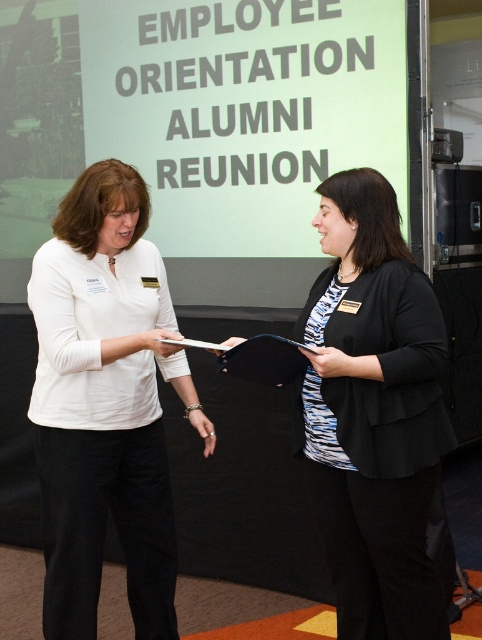
Is black matte blazer at center shorter than black matte folder at center?

Incorrect, black matte blazer at center's height does not fall short of black matte folder at center's.

How much distance is there between black matte blazer at center and black matte folder at center?

They are 10.36 inches apart.

In the scene shown: Who is more distant from viewer, [399,381] or [252,372]?

The point [252,372] is more distant.

You are a GUI agent. You are given a task and a screenshot of the screen. Output one action in this format:
    pyautogui.click(x=<x>, y=<y>)
    Task: Click on the black matte blazer at center
    The height and width of the screenshot is (640, 482).
    Given the screenshot: What is the action you would take?
    pyautogui.click(x=373, y=413)

Measure the distance between white matte shirt at center and black matte folder at center.

The distance of white matte shirt at center from black matte folder at center is 17.00 inches.

Which is more to the left, white matte shirt at center or black matte folder at center?

white matte shirt at center is more to the left.

Between point (137, 321) and point (296, 362), which one is positioned in front?

Point (296, 362) is in front.

Find the location of `white matte shirt at center`. white matte shirt at center is located at coordinates (106, 404).

Who is higher up, white matte shirt at center or black matte blazer at center?

Positioned higher is black matte blazer at center.

Does white matte shirt at center appear on the left side of black matte blazer at center?

Yes, white matte shirt at center is to the left of black matte blazer at center.

This screenshot has height=640, width=482. Identify the location of white matte shirt at center. (106, 404).